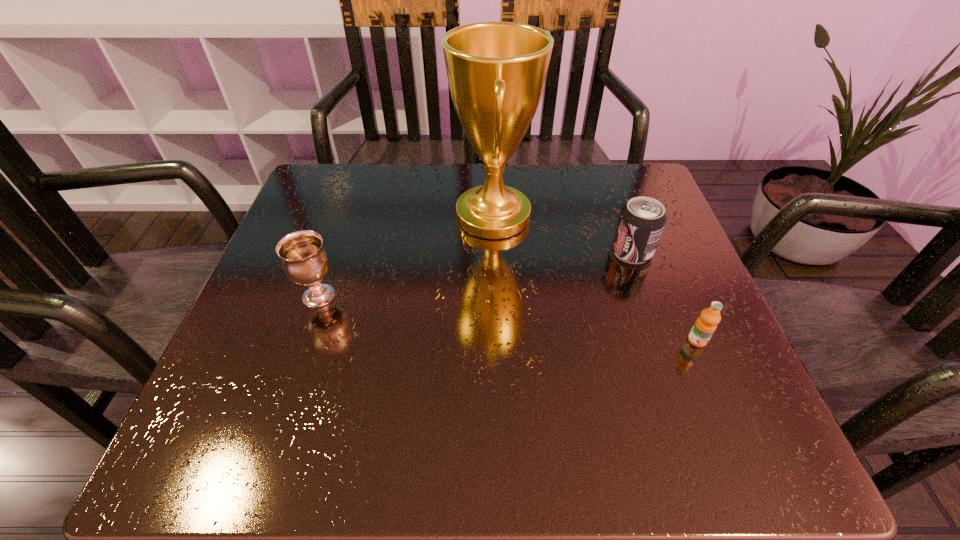
The height and width of the screenshot is (540, 960). I want to click on the tallest object, so click(x=496, y=71).

Identify the location of the second object from left to right. (496, 71).

I want to click on the third farthest object, so click(x=305, y=261).

Find the location of a particular element. This screenshot has width=960, height=540. chalice is located at coordinates (305, 261).

What are the coordinates of `soda can` in the screenshot? It's located at (641, 221).

Locate an element on the screen. This screenshot has width=960, height=540. orange juice is located at coordinates (706, 324).

Locate an element on the screen. The image size is (960, 540). the nearest object is located at coordinates (706, 324).

Identify the location of vacant space located by the handles of the second object from left to right. The width and height of the screenshot is (960, 540). (340, 216).

The width and height of the screenshot is (960, 540). Identify the location of vacant space located 0.110m by the handles of the second object from left to right. (404, 216).

Locate an element on the screen. This screenshot has height=540, width=960. free space located by the handles of the second object from left to right is located at coordinates (335, 216).